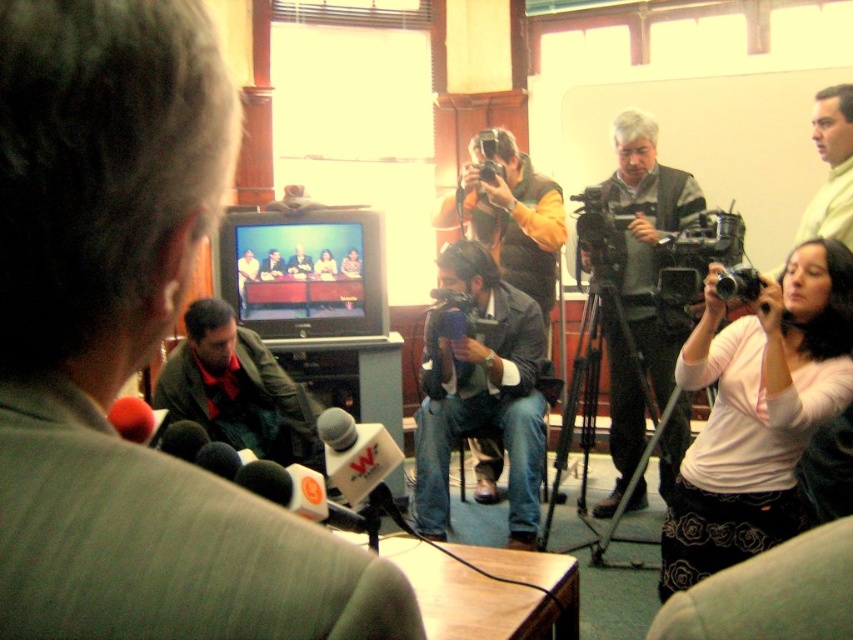
Image resolution: width=853 pixels, height=640 pixels. Find the location of `orange fabric camera at center`. orange fabric camera at center is located at coordinates (511, 220).

Is orange fabric camera at center thinner than metallic silver camera at center?

Incorrect, orange fabric camera at center's width is not less than metallic silver camera at center's.

Is point (514, 180) farther from viewer compared to point (732, 280)?

That is True.

At what (x,y) coordinates should I click in order to perform the action: click on orange fabric camera at center. Please return your answer as a coordinate pair (x, y). Image resolution: width=853 pixels, height=640 pixels. Looking at the image, I should click on (511, 220).

Can you confirm if green fabric jacket at left is taller than green matte jacket at center?

No, green fabric jacket at left is not taller than green matte jacket at center.

Consider the image. Which is below, green fabric jacket at left or green matte jacket at center?

Positioned lower is green matte jacket at center.

Who is more forward, (93,588) or (300,385)?

Point (93,588)

Identify the location of green fabric jacket at left. (132, 349).

Does metallic silver camera at center have a greater height compared to black plastic camera at center?

No.

The width and height of the screenshot is (853, 640). In order to click on metallic silver camera at center in this screenshot , I will do `click(738, 284)`.

Locate an element on the screen. This screenshot has width=853, height=640. metallic silver camera at center is located at coordinates click(738, 284).